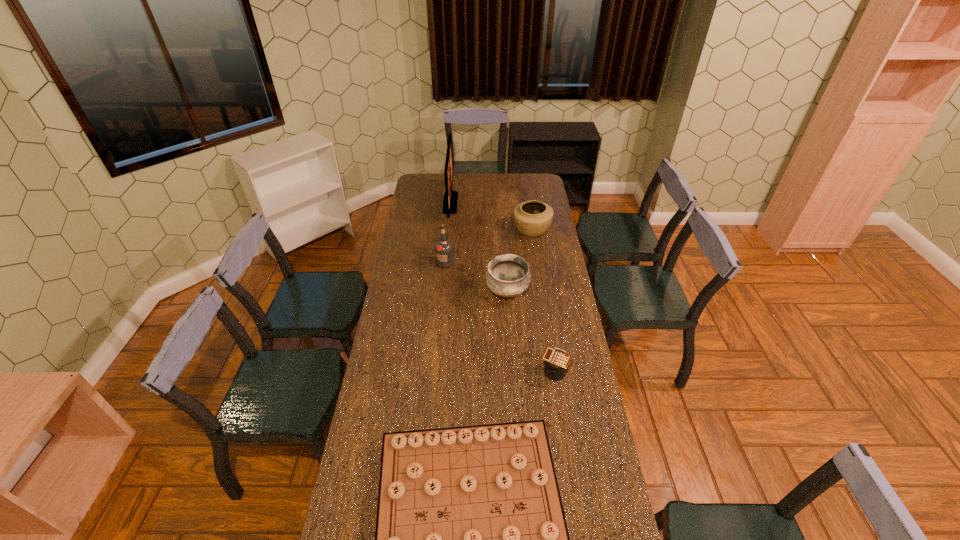
What are the coordinates of `the tallest object` in the screenshot? It's located at coord(450,197).

The width and height of the screenshot is (960, 540). Identify the location of the fifth shortest object. (444, 249).

Locate an element on the screen. vodka is located at coordinates (444, 249).

You are a GUI agent. You are given a task and a screenshot of the screen. Output one action in this format:
    pyautogui.click(x=<x>, y=<y>)
    Task: Click on the fourth farthest object
    This screenshot has height=540, width=960.
    Given the screenshot: What is the action you would take?
    pyautogui.click(x=508, y=275)

Locate an element on the screen. The image size is (960, 540). the farther pottery is located at coordinates (533, 218).

You are a GUI agent. You are given a task and a screenshot of the screen. Output one action in this format:
    pyautogui.click(x=<x>, y=<y>)
    Task: Click on the calculator
    
    Given the screenshot: What is the action you would take?
    pyautogui.click(x=556, y=360)

The image size is (960, 540). Find the location of `the second shortest object`. the second shortest object is located at coordinates (556, 360).

You are a GUI agent. You are given a task and a screenshot of the screen. Output one action in this format:
    pyautogui.click(x=<x>, y=<y>)
    Task: Click on the vacant space situated on the front-facing side of the monitor
    This screenshot has height=540, width=960.
    Given the screenshot: What is the action you would take?
    pyautogui.click(x=514, y=203)

Where is `vacant position located on the front label of the vodka`? The height and width of the screenshot is (540, 960). vacant position located on the front label of the vodka is located at coordinates click(440, 320).

Locate an element on the screen. vacant space located 0.360m on the back of the nearer pottery is located at coordinates pos(503,234).